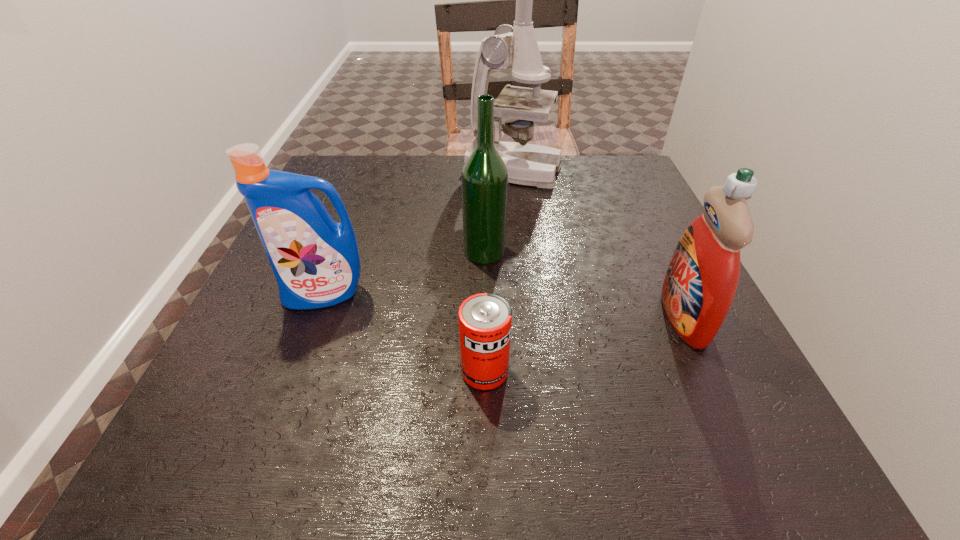
Where is `vacant space at the far right corner`? Image resolution: width=960 pixels, height=540 pixels. vacant space at the far right corner is located at coordinates (628, 186).

The image size is (960, 540). What are the coordinates of `empty space between the tallest object and the right detergent` in the screenshot? It's located at (598, 244).

This screenshot has width=960, height=540. What are the coordinates of `unoccupied position between the rightmost object and the can` in the screenshot? It's located at (584, 344).

This screenshot has width=960, height=540. In order to click on free spot between the right detergent and the farthest object in this screenshot , I will do `click(598, 244)`.

Find the location of a particular element. The width and height of the screenshot is (960, 540). free spot between the microscope and the left detergent is located at coordinates (420, 233).

Image resolution: width=960 pixels, height=540 pixels. In order to click on vacant space that's between the fourth nearest object and the leftmost object in this screenshot , I will do `click(405, 273)`.

Find the location of `vacant area that lies between the left detergent and the fourth nearest object`. vacant area that lies between the left detergent and the fourth nearest object is located at coordinates (405, 273).

This screenshot has width=960, height=540. Find the location of `unoccupied area between the rightmost object and the shortest object`. unoccupied area between the rightmost object and the shortest object is located at coordinates tap(584, 344).

Find the location of `free point between the right detergent and the microscope`. free point between the right detergent and the microscope is located at coordinates (598, 244).

Locate an element on the screen. The height and width of the screenshot is (540, 960). object identified as the fourth closest to the leftmost object is located at coordinates (699, 287).